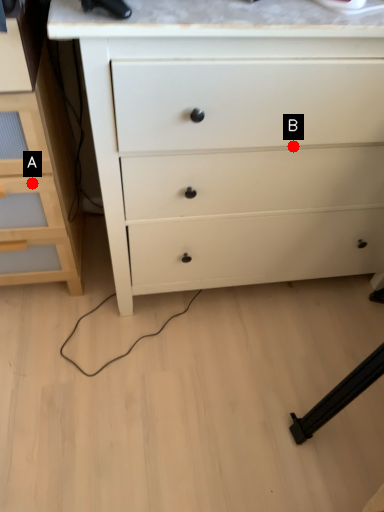
Question: Two points are circled on the image, labeled by A and B beside each circle. Among these points, which one is nearest to the camera?

Choices:
 (A) A is closer
 (B) B is closer

Answer: (B)